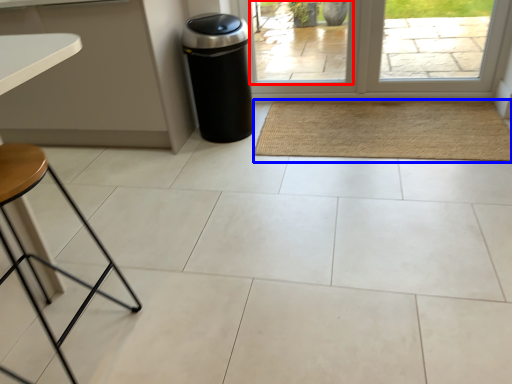
Question: Among these objects, which one is nearest to the camera, window (highlighted by a red box) or mat (highlighted by a blue box)?

Choices:
 (A) window
 (B) mat

Answer: (B)